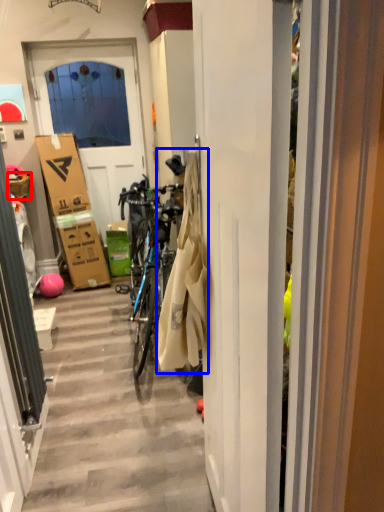
Question: Which point is further to the camera, picnic basket (highlighted by a red box) or laundry (highlighted by a blue box)?

Choices:
 (A) picnic basket
 (B) laundry

Answer: (A)